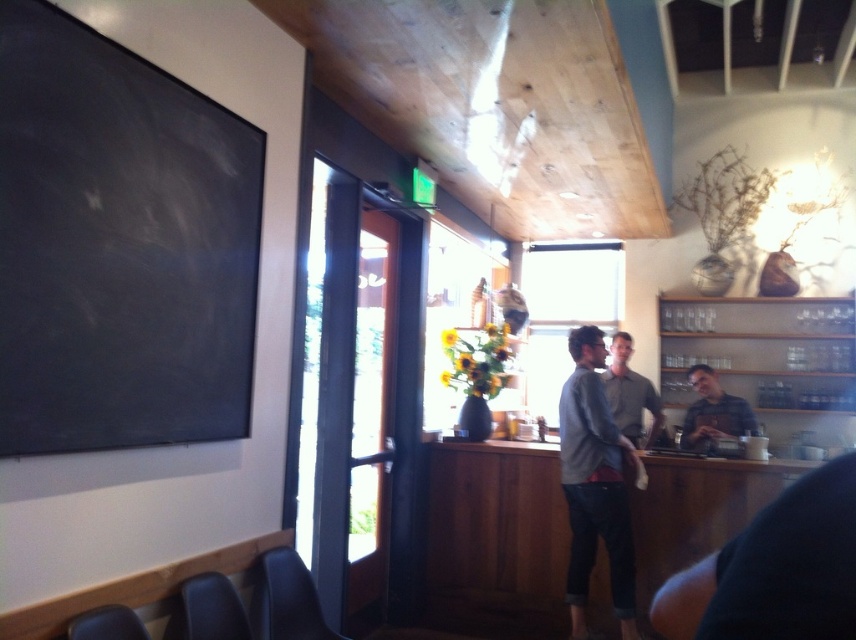
You are a customer in this cozy cafe and you see two items on the counter, a matte gray shirt at center and a gray sweater at center. Which one is shorter in height?

Result: The matte gray shirt at center is shorter in height compared to the gray sweater at center.